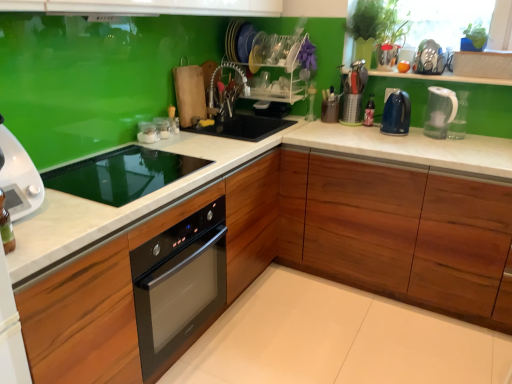
The image size is (512, 384). What do you see at coordinates (399, 234) in the screenshot?
I see `wooden cabinet at lower right, which ranks as the 1th cabinetry in right-to-left order` at bounding box center [399, 234].

The height and width of the screenshot is (384, 512). Describe the element at coordinates (272, 60) in the screenshot. I see `clear plastic dish rack at center, which ranks as the 1th shelf in top-to-bottom order` at that location.

Identify the location of blue glossy electric kettle at upper right, which is counted as the 2th kitchen appliance, starting from the right. (396, 114).

Is point (192, 198) more distant than point (24, 210)?

Yes, point (192, 198) is behind point (24, 210).

Is white glossy microwave at left located within white marble countertop at center?

No, white marble countertop at center does not contain white glossy microwave at left.

What's the angular difference between white marble countertop at center and white glossy microwave at left's facing directions?

91.6 degrees.

Based on the photo, is white marble countertop at center bigger than white glossy microwave at left?

Indeed, white marble countertop at center has a larger size compared to white glossy microwave at left.

In the scene shown: Is wooden cabinet at center, which is counted as the second cabinetry, starting from the right, looking in the opposite direction of green glossy plant at upper right?

wooden cabinet at center, which is counted as the second cabinetry, starting from the right, is not turned away from green glossy plant at upper right.

Between wooden cabinet at center, which appears as the 1th cabinetry when viewed from the left, and green glossy plant at upper right, which one has more height?

Standing taller between the two is wooden cabinet at center, which appears as the 1th cabinetry when viewed from the left.

Between wooden cabinet at center, which is counted as the second cabinetry, starting from the right, and green glossy plant at upper right, which one has smaller width?

green glossy plant at upper right.

Which is correct: wooden cabinet at center, which appears as the 1th cabinetry when viewed from the left, is inside green glossy plant at upper right, or outside of it?

wooden cabinet at center, which appears as the 1th cabinetry when viewed from the left, is not enclosed by green glossy plant at upper right.

From the wooden cabinet at center, which appears as the 1th cabinetry when viewed from the left, count 1st shelf to the right and point to it. Please provide its 2D coordinates.

[(276, 88)]

Can you confirm if clear plastic dish rack at upper center, which ranks as the 1th shelf in bottom-to-top order, is shorter than wooden cabinet at center, which appears as the 1th cabinetry when viewed from the left?

Indeed, clear plastic dish rack at upper center, which ranks as the 1th shelf in bottom-to-top order, has a lesser height compared to wooden cabinet at center, which appears as the 1th cabinetry when viewed from the left.

Is clear plastic dish rack at upper center, which is the second shelf from top to bottom, inside or outside of wooden cabinet at center, which appears as the 1th cabinetry when viewed from the left?

clear plastic dish rack at upper center, which is the second shelf from top to bottom, exists outside the volume of wooden cabinet at center, which appears as the 1th cabinetry when viewed from the left.

Is white marble countertop at center located outside metallic silver utensil holder at upper right, which ranks as the 2th appliance in right-to-left order?

Yes, white marble countertop at center is located beyond the bounds of metallic silver utensil holder at upper right, which ranks as the 2th appliance in right-to-left order.

Which is behind, point (343, 281) or point (349, 108)?

Positioned behind is point (349, 108).

From a real-world perspective, which is physically above, white marble countertop at center or metallic silver utensil holder at upper right, which ranks as the 2th appliance in right-to-left order?

metallic silver utensil holder at upper right, which ranks as the 2th appliance in right-to-left order, from a real-world perspective.

Is white marble countertop at center next to metallic silver utensil holder at upper right, marked as the 5th appliance in a left-to-right arrangement?

No, white marble countertop at center is not beside metallic silver utensil holder at upper right, marked as the 5th appliance in a left-to-right arrangement.

Considering the positions of objects blue glossy electric kettle at upper right, which is counted as the 2th kitchen appliance, starting from the right, and transparent glass bottle at upper right, the 2th bottle in the front-to-back sequence, in the image provided, who is more to the right, blue glossy electric kettle at upper right, which is counted as the 2th kitchen appliance, starting from the right, or transparent glass bottle at upper right, the 2th bottle in the front-to-back sequence,?

Positioned to the right is blue glossy electric kettle at upper right, which is counted as the 2th kitchen appliance, starting from the right.

Is blue glossy electric kettle at upper right, which is counted as the 2th kitchen appliance, starting from the right, situated inside transparent glass bottle at upper right, the second bottle viewed from the right, or outside?

blue glossy electric kettle at upper right, which is counted as the 2th kitchen appliance, starting from the right, is outside transparent glass bottle at upper right, the second bottle viewed from the right.

In terms of size, does blue glossy electric kettle at upper right, which is counted as the 2th kitchen appliance, starting from the right, appear bigger or smaller than transparent glass bottle at upper right, the second bottle viewed from the right?

Clearly, blue glossy electric kettle at upper right, which is counted as the 2th kitchen appliance, starting from the right, is larger in size than transparent glass bottle at upper right, the second bottle viewed from the right.

Between blue glossy electric kettle at upper right, which is counted as the 2th kitchen appliance, starting from the right, and transparent glass bottle at upper right, the second bottle viewed from the right, which one has more height?

Standing taller between the two is transparent glass bottle at upper right, the second bottle viewed from the right.

How many degrees apart are the facing directions of transparent plastic kettle at right, the 2th kitchen appliance positioned from the left, and white marble countertop at center?

The angular difference between transparent plastic kettle at right, the 2th kitchen appliance positioned from the left, and white marble countertop at center is 30.9 degrees.

From the image's perspective, who appears lower, transparent plastic kettle at right, positioned as the 1th kitchen appliance in right-to-left order, or white marble countertop at center?

white marble countertop at center, from the image's perspective.

Is transparent plastic kettle at right, positioned as the 1th kitchen appliance in right-to-left order, in front of or behind white marble countertop at center in the image?

transparent plastic kettle at right, positioned as the 1th kitchen appliance in right-to-left order, is positioned farther from the viewer than white marble countertop at center.

From a real-world perspective, who is located lower, transparent plastic kettle at right, positioned as the 1th kitchen appliance in right-to-left order, or white marble countertop at center?

In real-world perspective, white marble countertop at center is lower.

Based on the photo, between clear glass jar at upper center, acting as the sixth appliance starting from the right, and transparent glass bottle at upper right, positioned as the first bottle in left-to-right order, which one has larger width?

With larger width is clear glass jar at upper center, acting as the sixth appliance starting from the right.

Between point (152, 124) and point (313, 83), which one is positioned in front?

The point (152, 124) is closer to the camera.

Who is taller, clear glass jar at upper center, acting as the sixth appliance starting from the right, or transparent glass bottle at upper right, positioned as the first bottle in left-to-right order?

transparent glass bottle at upper right, positioned as the first bottle in left-to-right order, is taller.

From the picture: Which of these two, clear glass jar at upper center, acting as the sixth appliance starting from the right, or transparent glass bottle at upper right, the second bottle viewed from the right, is bigger?

Bigger between the two is transparent glass bottle at upper right, the second bottle viewed from the right.

Identify the location of home appliance on the left of the white marble countertop at center. The width and height of the screenshot is (512, 384). (19, 177).

At what (x,y) coordinates should I click in order to perform the action: click on plant that is above the wooden cabinet at center, which appears as the 1th cabinetry when viewed from the left (from the image's perspective). Please return your answer as a coordinate pair (x, y). Image resolution: width=512 pixels, height=384 pixels. Looking at the image, I should click on (376, 21).

Based on the photo, when comparing their distances from white glossy microwave at left, does metallic silver utensil holder at upper right, marked as the 5th appliance in a left-to-right arrangement, or clear plastic dish rack at upper center, which ranks as the 1th shelf in bottom-to-top order, seem further?

metallic silver utensil holder at upper right, marked as the 5th appliance in a left-to-right arrangement, is positioned further to the anchor white glossy microwave at left.

From the image, which object appears to be farther from wooden cabinet at center, which appears as the 1th cabinetry when viewed from the left, clear plastic dish rack at upper center, which ranks as the 1th shelf in bottom-to-top order, or clear glass jars at center, which is counted as the 3th appliance, starting from the left?

clear plastic dish rack at upper center, which ranks as the 1th shelf in bottom-to-top order, lies further to wooden cabinet at center, which appears as the 1th cabinetry when viewed from the left, than the other object.

Based on their spatial positions, is green glossy plant at upper right or white glossy microwave at left further from brown matte utensil holder at center, placed as the fourth appliance when sorted from left to right?

Among the two, white glossy microwave at left is located further to brown matte utensil holder at center, placed as the fourth appliance when sorted from left to right.

Based on their spatial positions, is metallic silver utensil holder at upper right, marked as the 5th appliance in a left-to-right arrangement, or wooden cabinet at lower right, marked as the 2th cabinetry in a left-to-right arrangement, further from flexible stainless steel faucet at center?

Among the two, wooden cabinet at lower right, marked as the 2th cabinetry in a left-to-right arrangement, is located further to flexible stainless steel faucet at center.

When comparing their distances from black glass cooktop at center, which is the 2th appliance from left to right, does wooden cabinet at lower right, marked as the 2th cabinetry in a left-to-right arrangement, or clear glass jars at center, which is counted as the 3th appliance, starting from the left, seem closer?

clear glass jars at center, which is counted as the 3th appliance, starting from the left, is closer to black glass cooktop at center, which is the 2th appliance from left to right.

From the image, which object appears to be nearer to green glossy plant at upper right, black glass cooktop at center, which is the 2th appliance from left to right, or clear glass jar at upper center, acting as the sixth appliance starting from the right?

The object closer to green glossy plant at upper right is clear glass jar at upper center, acting as the sixth appliance starting from the right.

Estimate the real-world distances between objects in this image. Which object is closer to clear glass jar at upper center, the 1th appliance from the left, black glass cooktop at center, arranged as the fifth appliance when viewed from the right, or transparent plastic kettle at right, positioned as the 1th kitchen appliance in right-to-left order?

Among the two, black glass cooktop at center, arranged as the fifth appliance when viewed from the right, is located nearer to clear glass jar at upper center, the 1th appliance from the left.

Estimate the real-world distances between objects in this image. Which object is closer to flexible stainless steel faucet at center, clear plastic bottle at center, which is the 1th bottle from front to back, or transparent plastic kettle at right, the 2th kitchen appliance positioned from the left?

Among the two, clear plastic bottle at center, which is the 1th bottle from front to back, is located nearer to flexible stainless steel faucet at center.

At what (x,y) coordinates should I click in order to perform the action: click on faucet situated between clear glass jar at upper center, the 1th appliance from the left, and clear plastic bottle at center, positioned as the second bottle in left-to-right order, from left to right. Please return your answer as a coordinate pair (x, y). The height and width of the screenshot is (384, 512). Looking at the image, I should click on (225, 92).

Where is `faucet between white glossy microwave at left and clear plastic bottle at center, positioned as the second bottle in left-to-right order, along the z-axis`? The height and width of the screenshot is (384, 512). faucet between white glossy microwave at left and clear plastic bottle at center, positioned as the second bottle in left-to-right order, along the z-axis is located at coordinates (225, 92).

Identify the location of faucet between clear glass jars at center, which is counted as the 3th appliance, starting from the left, and transparent plastic kettle at right, positioned as the 1th kitchen appliance in right-to-left order, in the horizontal direction. (225, 92).

Where is `kitchen appliance positioned between transparent plastic kettle at right, the 2th kitchen appliance positioned from the left, and clear plastic bottle at center, positioned as the second bottle in left-to-right order, from near to far`? Image resolution: width=512 pixels, height=384 pixels. kitchen appliance positioned between transparent plastic kettle at right, the 2th kitchen appliance positioned from the left, and clear plastic bottle at center, positioned as the second bottle in left-to-right order, from near to far is located at coordinates (396, 114).